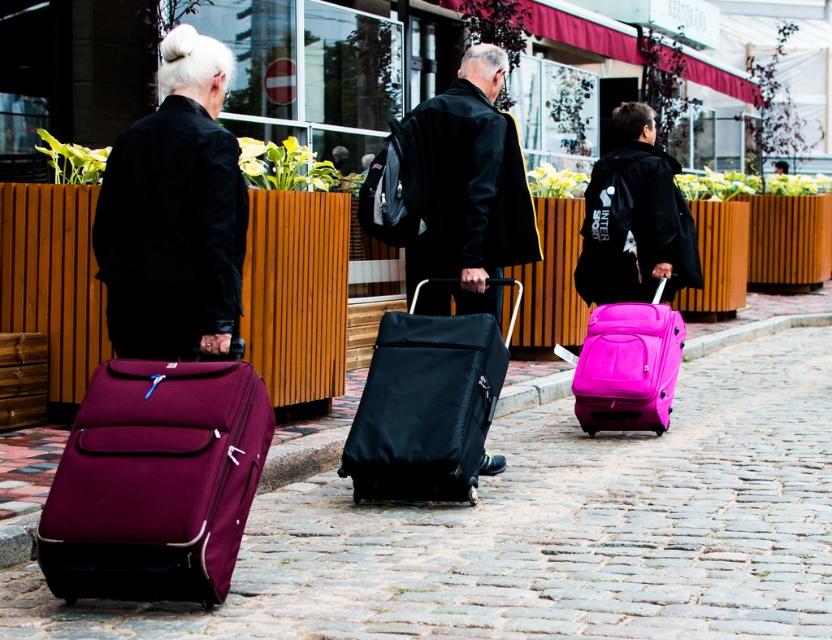
Based on the photo, you are standing at the origin point of the coordinate system in the image. The burgundy fabric suitcase at lower left is located at point 0.753, 0.188. Which direction should you move to reach it?

To reach the burgundy fabric suitcase at lower left located at coordinates (156,481), you should move in the positive x and positive y direction since both coordinates are greater than zero.

You are standing behind three people walking away from you on a cobblestone street. You notice the matte black suitcase at center and the pink matte suitcase at right. Which suitcase is positioned closer to the right side of the street?

The pink matte suitcase at right is positioned closer to the right side of the street because the matte black suitcase at center is to the left of it.

You are standing at the end of the cobblestone street looking towards the three people. Which object is positioned lower in the image, the burgundy fabric suitcase at lower left or the matte black jacket at upper left?

The burgundy fabric suitcase at lower left is positioned below the matte black jacket at upper left in the image.